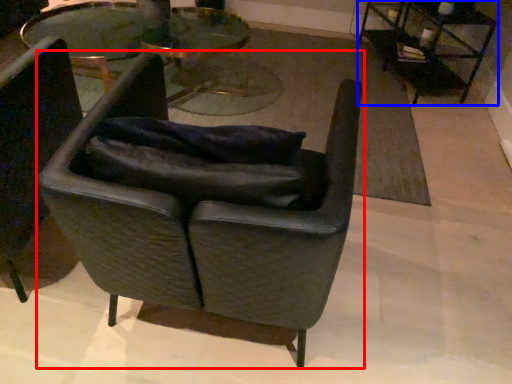
Question: Which object is closer to the camera taking this photo, chair (highlighted by a red box) or table (highlighted by a blue box)?

Choices:
 (A) chair
 (B) table

Answer: (A)